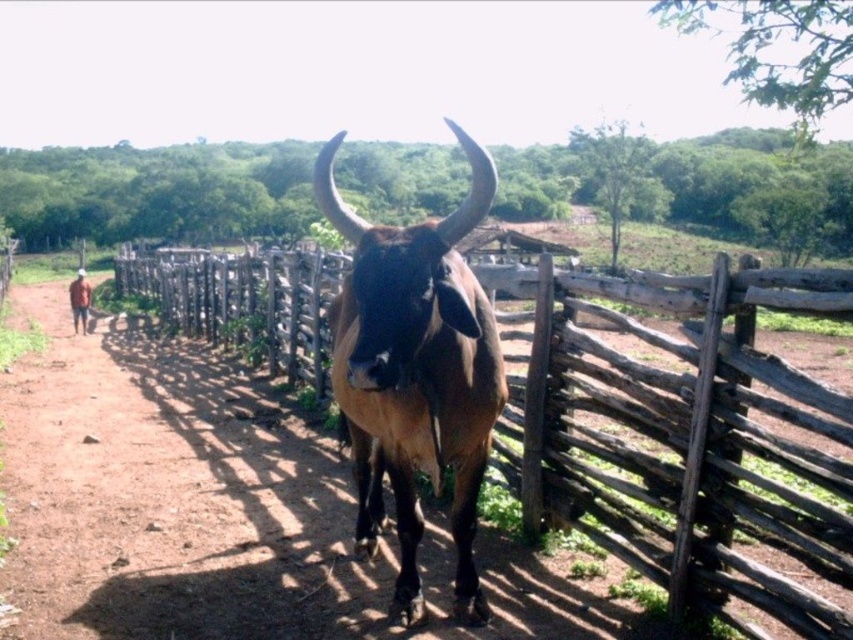
Can you confirm if brown wooden fence at center is thinner than brown glossy bull at center?

No, brown wooden fence at center is not thinner than brown glossy bull at center.

Is point (190, 275) farther from camera compared to point (390, 445)?

Yes.

Between point (780, 369) and point (456, 420), which one is positioned in front?

Point (780, 369) is more forward.

Find the location of `brown wooden fence at center`. brown wooden fence at center is located at coordinates (682, 433).